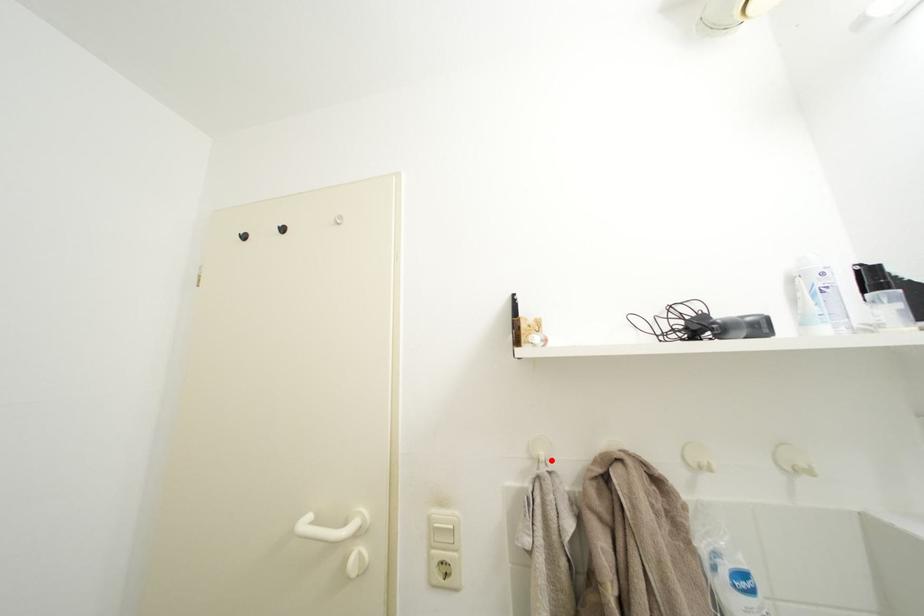
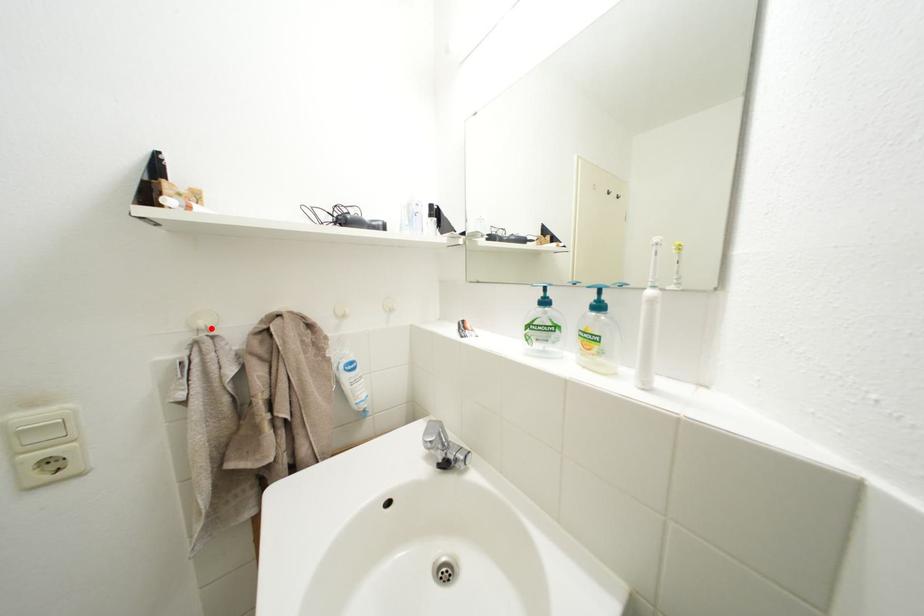
I am providing you with two images of the same scene from different viewpoints. A red point is marked on the first image and another point is marked on the second image. Do the highlighted points in image1 and image2 indicate the same real-world spot?

Yes